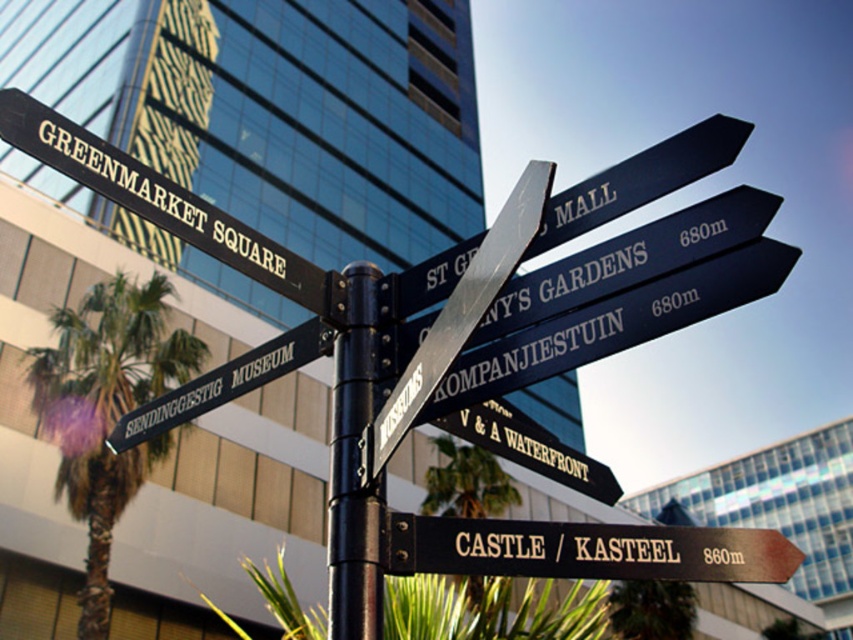
Between point (144, 476) and point (343, 376), which one is positioned behind?

Positioned behind is point (144, 476).

Which is in front, point (120, 467) or point (344, 394)?

Point (344, 394)

This screenshot has height=640, width=853. In order to click on green leafy palm tree at left in this screenshot , I will do `click(106, 410)`.

Which is above, brown wooden sign at lower right or black metal pole at center?

black metal pole at center

The height and width of the screenshot is (640, 853). What do you see at coordinates (584, 550) in the screenshot?
I see `brown wooden sign at lower right` at bounding box center [584, 550].

This screenshot has width=853, height=640. Find the location of `brown wooden sign at lower right`. brown wooden sign at lower right is located at coordinates (584, 550).

Which of these two, green leafy palm tree at left or brown wooden sign at lower right, stands taller?

With more height is green leafy palm tree at left.

Is point (90, 616) less distant than point (656, 573)?

No, (90, 616) is behind (656, 573).

This screenshot has width=853, height=640. Find the location of `green leafy palm tree at left`. green leafy palm tree at left is located at coordinates (106, 410).